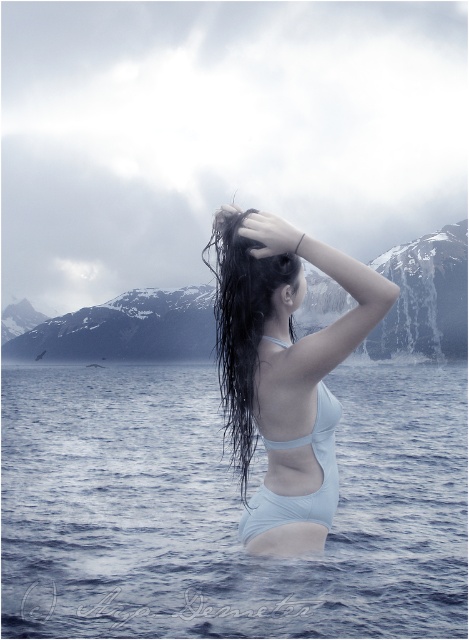
Question: Which of the following is the closest to the observer?

Choices:
 (A) (219, 224)
 (B) (331, 461)
 (C) (239, 280)

Answer: (B)

Question: Can you confirm if blue water at center is smaller than white matte bikini at center?

Choices:
 (A) no
 (B) yes

Answer: (A)

Question: Estimate the real-world distances between objects in this image. Which object is farther from the white matte swimsuit at center?

Choices:
 (A) white matte bikini at center
 (B) wet dark brown hair at center

Answer: (B)

Question: Does white matte bikini at center appear under white matte bikini top at upper center?

Choices:
 (A) yes
 (B) no

Answer: (A)

Question: Is the position of white matte swimsuit at center more distant than that of wet dark brown hair at center?

Choices:
 (A) yes
 (B) no

Answer: (B)

Question: Which point is closer to the camera?

Choices:
 (A) white matte bikini top at upper center
 (B) blue water at center
 (C) wet dark brown hair at center
 (D) white matte swimsuit at center

Answer: (D)